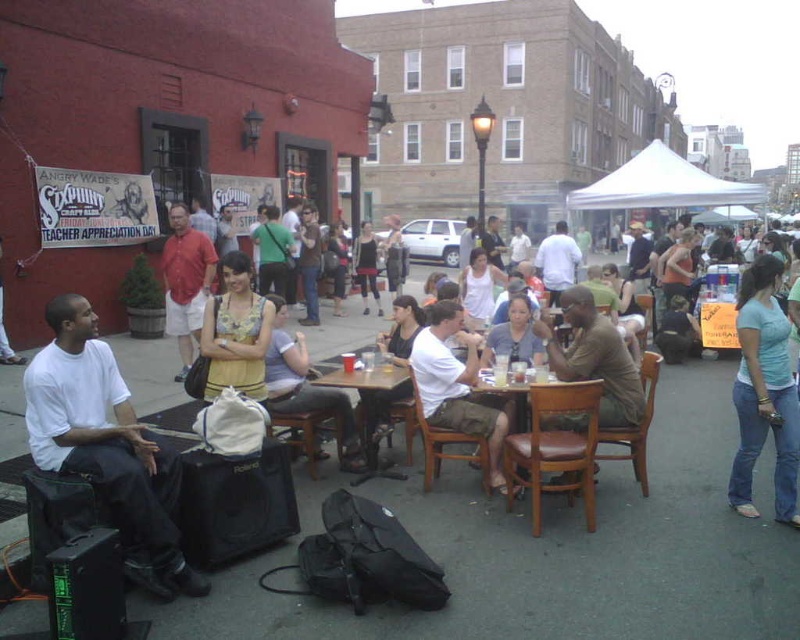
Which is in front, point (754, 326) or point (496, 451)?

Point (754, 326) is more forward.

Does light blue denim jeans at lower right appear over brown leather table at center?

Indeed, light blue denim jeans at lower right is positioned over brown leather table at center.

Locate an element on the screen. The width and height of the screenshot is (800, 640). light blue denim jeans at lower right is located at coordinates point(764,392).

The height and width of the screenshot is (640, 800). I want to click on wooden table at center, so click(370, 401).

Is wooden table at center taller than brown leather table at center?

In fact, wooden table at center may be shorter than brown leather table at center.

Where is `wooden table at center`? This screenshot has width=800, height=640. wooden table at center is located at coordinates (370, 401).

Where is `wooden table at center`? This screenshot has height=640, width=800. wooden table at center is located at coordinates (370, 401).

Consider the image. Is light blue denim jeans at lower right bigger than wooden table at center?

Indeed, light blue denim jeans at lower right has a larger size compared to wooden table at center.

Identify the location of light blue denim jeans at lower right. (764, 392).